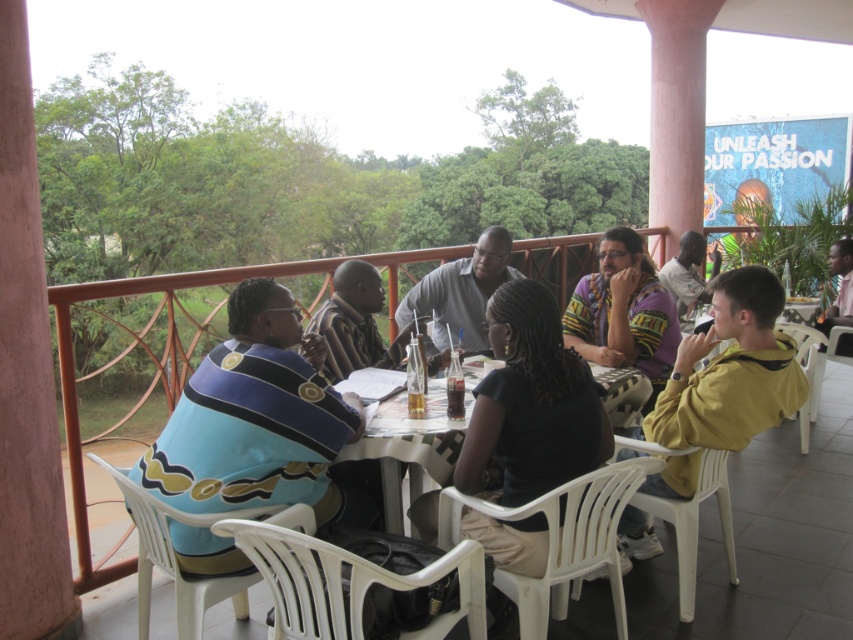
Question: Which object appears closest to the camera in this image?

Choices:
 (A) matte black shirt at upper right
 (B) blue striped sweater at left

Answer: (B)

Question: Is black matte shirt at center closer to camera compared to white plastic table at center?

Choices:
 (A) no
 (B) yes

Answer: (B)

Question: Which object appears farthest from the camera in this image?

Choices:
 (A) blue striped sweater at left
 (B) pink shirt at upper right
 (C) white plastic table at center
 (D) light gray shirt at center

Answer: (B)

Question: Can you confirm if light gray shirt at center is bigger than pink shirt at upper right?

Choices:
 (A) no
 (B) yes

Answer: (A)

Question: Which object is closer to the camera taking this photo?

Choices:
 (A) black matte shirt at center
 (B) blue striped sweater at left
 (C) light gray shirt at center

Answer: (B)

Question: Is light gray shirt at center thinner than pink shirt at upper right?

Choices:
 (A) no
 (B) yes

Answer: (A)